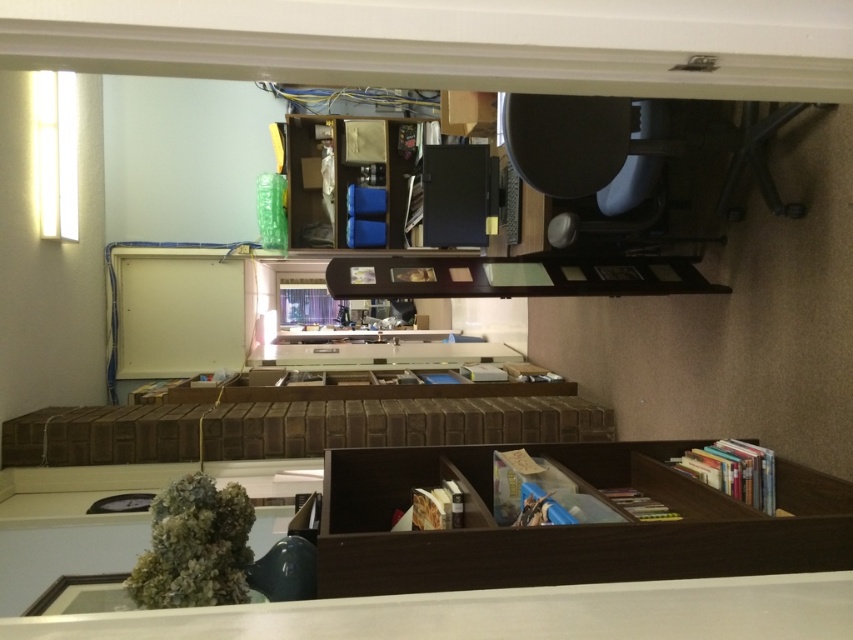
Question: Is brown wood bookshelf at center below brown wooden drawer at center?

Choices:
 (A) yes
 (B) no

Answer: (A)

Question: Based on their relative distances, which object is nearer to the brown wooden drawer at center?

Choices:
 (A) wooden frame at center
 (B) wooden bookshelf at upper center
 (C) brown wood bookshelf at center

Answer: (A)

Question: Does brown wood bookshelf at center appear on the right side of wooden frame at center?

Choices:
 (A) yes
 (B) no

Answer: (B)

Question: Can you confirm if brown wood bookshelf at center is positioned to the left of wooden frame at center?

Choices:
 (A) no
 (B) yes

Answer: (B)

Question: Which is farther from the wooden frame at center?

Choices:
 (A) brown wooden drawer at center
 (B) brown wood bookshelf at center
 (C) wooden bookshelf at upper center

Answer: (C)

Question: Which point appears closest to the camera in this image?

Choices:
 (A) (419, 141)
 (B) (485, 275)

Answer: (B)